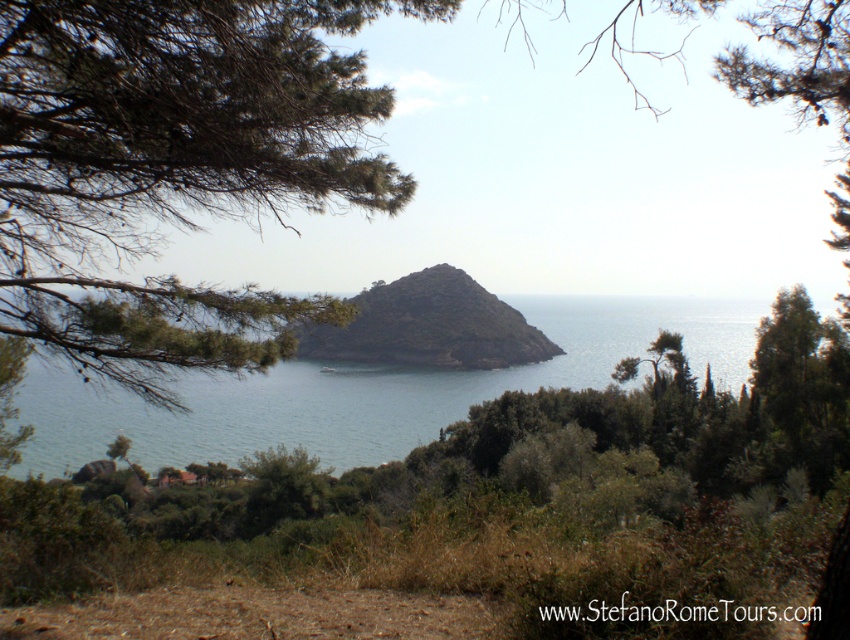
Question: Does greenish-blue water at center have a greater width compared to green leafy tree at center-right?

Choices:
 (A) no
 (B) yes

Answer: (B)

Question: Can you confirm if greenish-blue water at center is positioned to the left of green leafy tree at center-right?

Choices:
 (A) no
 (B) yes

Answer: (A)

Question: Which object is closer to the camera taking this photo?

Choices:
 (A) brown rocky hillside at center
 (B) greenish-blue water at center
 (C) green leafy tree at center-right
 (D) green leafy tree at center

Answer: (D)

Question: Can you confirm if green leafy tree at center is smaller than brown rocky hillside at center?

Choices:
 (A) yes
 (B) no

Answer: (A)

Question: Which object is farther from the camera taking this photo?

Choices:
 (A) brown rocky hillside at center
 (B) green leafy tree at center-right
 (C) greenish-blue water at center
 (D) green leafy tree at center

Answer: (B)

Question: Among these points, which one is nearest to the camera?

Choices:
 (A) (374, 189)
 (B) (136, 451)

Answer: (A)